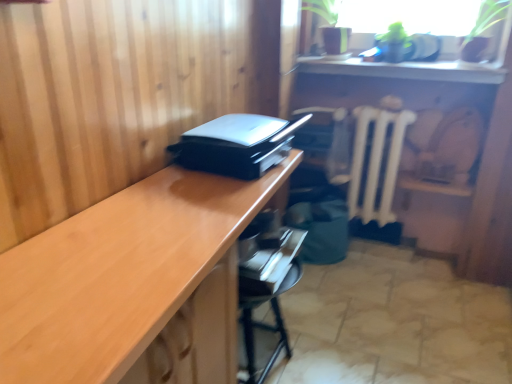
Question: From the image's perspective, is white matte radiator at center above or below metallic black drawer at lower center?

Choices:
 (A) above
 (B) below

Answer: (A)

Question: From a real-world perspective, is white matte radiator at center positioned above or below metallic black drawer at lower center?

Choices:
 (A) above
 (B) below

Answer: (A)

Question: Based on their relative distances, which object is farther from the glossy wood desk at center?

Choices:
 (A) white matte radiator at center
 (B) black plastic printer at center
 (C) metallic black drawer at lower center
 (D) black plastic drawer at center
 (E) white glossy counter top at upper right

Answer: (D)

Question: Which is farther from the black plastic printer at center?

Choices:
 (A) black plastic drawer at center
 (B) white matte radiator at center
 (C) glossy wood desk at center
 (D) white glossy counter top at upper right
 (E) metallic black drawer at lower center

Answer: (D)